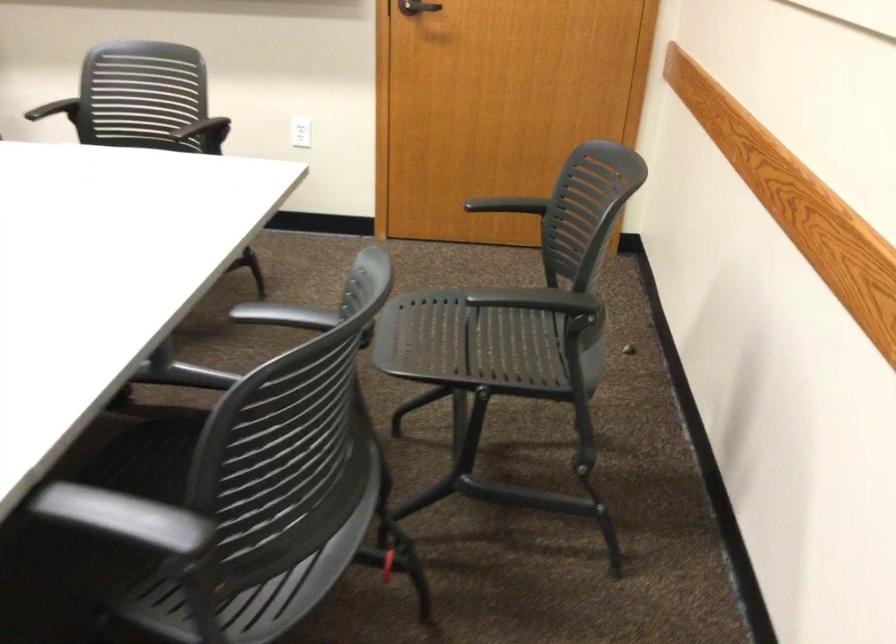
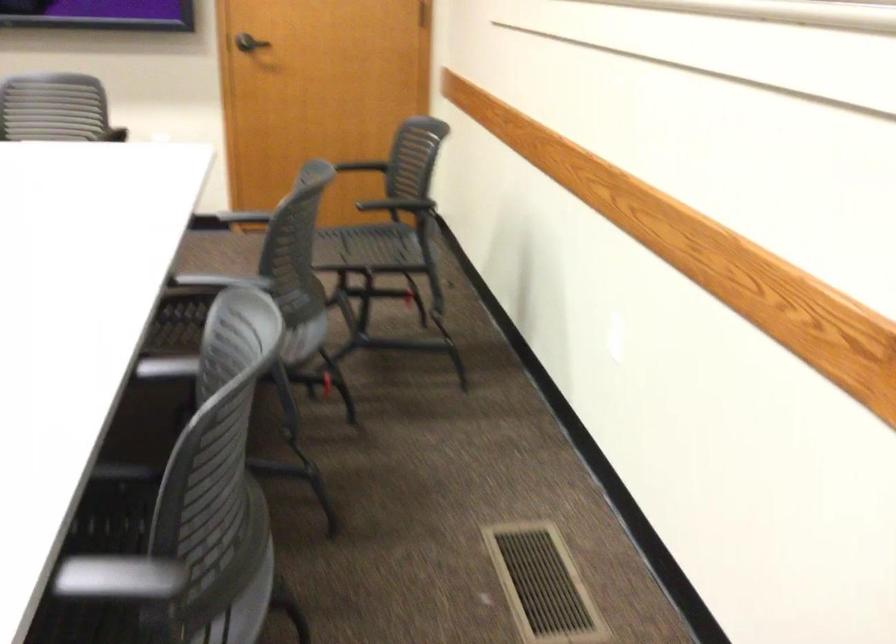
In the second image, find the point that corresponds to point 134,495 in the first image.

(220, 281)